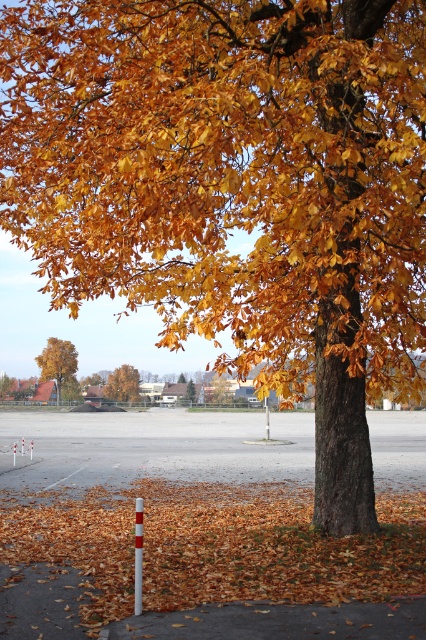
Who is lower down, brown leaf litter at lower center or golden leafy tree at center?

brown leaf litter at lower center is below.

Who is shorter, brown leaf litter at lower center or golden leafy tree at center?

brown leaf litter at lower center

Is point (226, 493) closer to viewer compared to point (131, 381)?

Yes, point (226, 493) is in front of point (131, 381).

Locate an element on the screen. The image size is (426, 640). brown leaf litter at lower center is located at coordinates (213, 545).

Between yellow/golden wood at left and golden leafy tree at center, which one appears on the left side from the viewer's perspective?

yellow/golden wood at left is more to the left.

Is yellow/golden wood at left behind golden leafy tree at center?

No.

Does point (71, 374) lie behind point (123, 394)?

No, (71, 374) is in front of (123, 394).

Locate an element on the screen. The width and height of the screenshot is (426, 640). yellow/golden wood at left is located at coordinates (57, 362).

Is brown leaf litter at lower center wider than yellow/golden wood at left?

Yes.

Is brown leaf litter at lower center smaller than yellow/golden wood at left?

Actually, brown leaf litter at lower center might be larger than yellow/golden wood at left.

Where is `brown leaf litter at lower center`? The height and width of the screenshot is (640, 426). brown leaf litter at lower center is located at coordinates (213, 545).